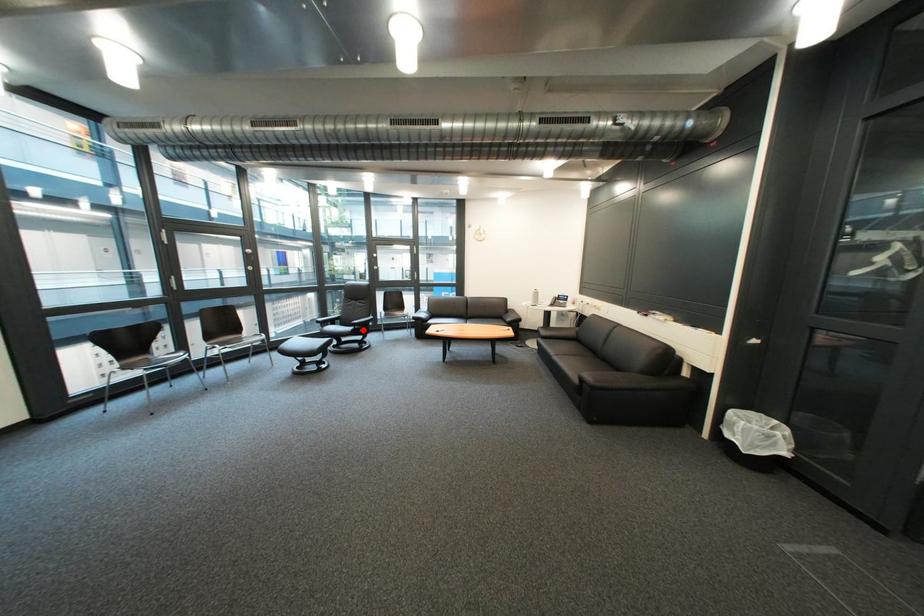
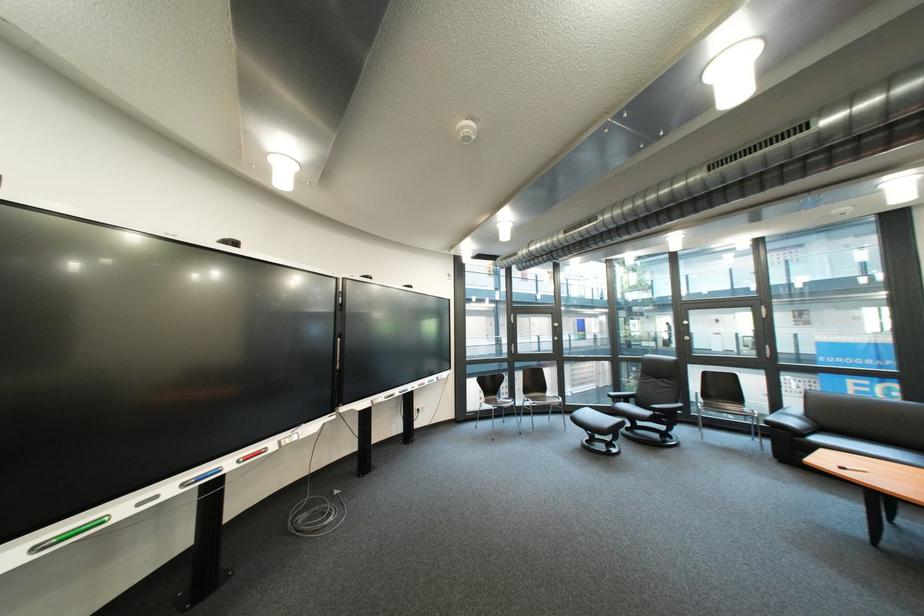
Where in the second image is the point corresponding to the highlighted location from the first image?

(661, 415)